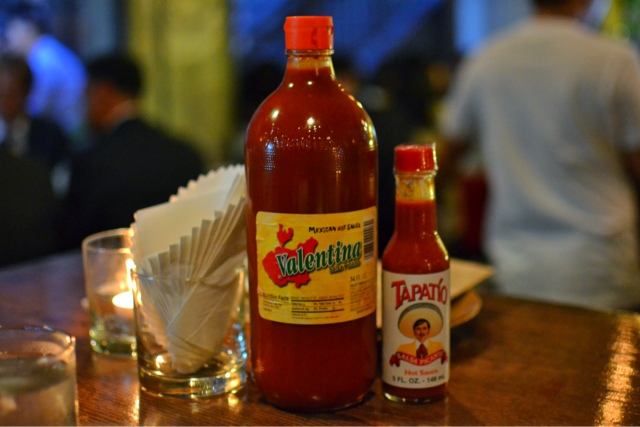
I want to click on small bottle of tapato hot sauce, so click(424, 262).